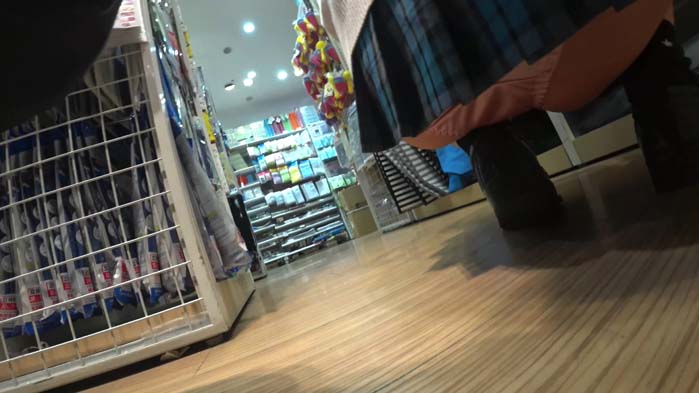
Identify the location of white ceiling. Image resolution: width=699 pixels, height=393 pixels. [273, 49].